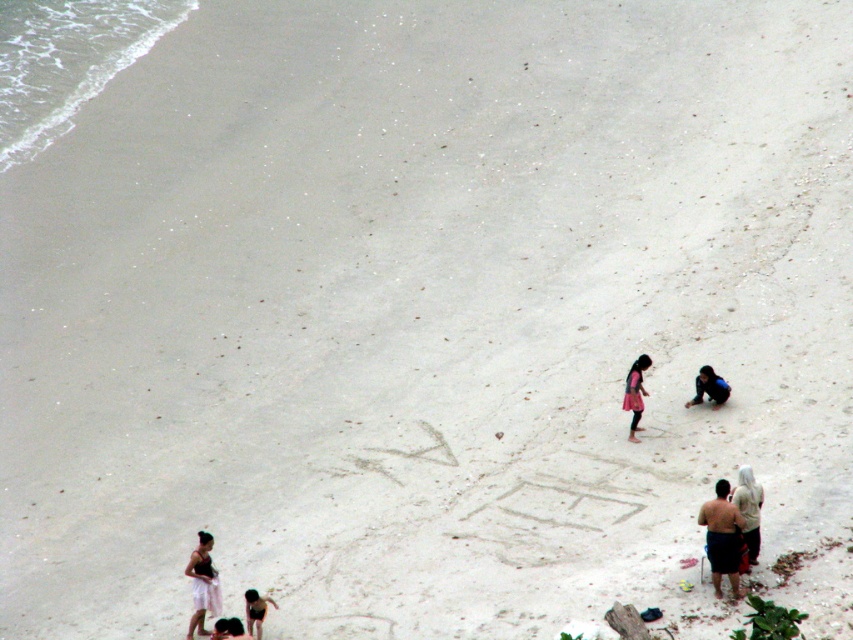
Question: Which point is farther to the camera?

Choices:
 (A) dark blue fabric at lower right
 (B) light brown skin at lower center

Answer: (A)

Question: Can you confirm if white cotton towel at lower left is thinner than light brown skin at lower center?

Choices:
 (A) no
 (B) yes

Answer: (B)

Question: Considering the real-world distances, which object is farthest from the light beige cotton shirt at lower right?

Choices:
 (A) dark brown skin at lower right
 (B) light brown skin at lower center
 (C) pink fabric dress at center

Answer: (B)

Question: Is light beige cotton shirt at lower right behind dark brown hair at lower center?

Choices:
 (A) no
 (B) yes

Answer: (B)

Question: Which point appears closest to the camera in this image?

Choices:
 (A) (752, 500)
 (B) (216, 627)
 (C) (189, 637)
 (D) (717, 384)

Answer: (B)

Question: Does dark blue fabric at lower right have a larger size compared to dark brown hair at lower center?

Choices:
 (A) yes
 (B) no

Answer: (A)